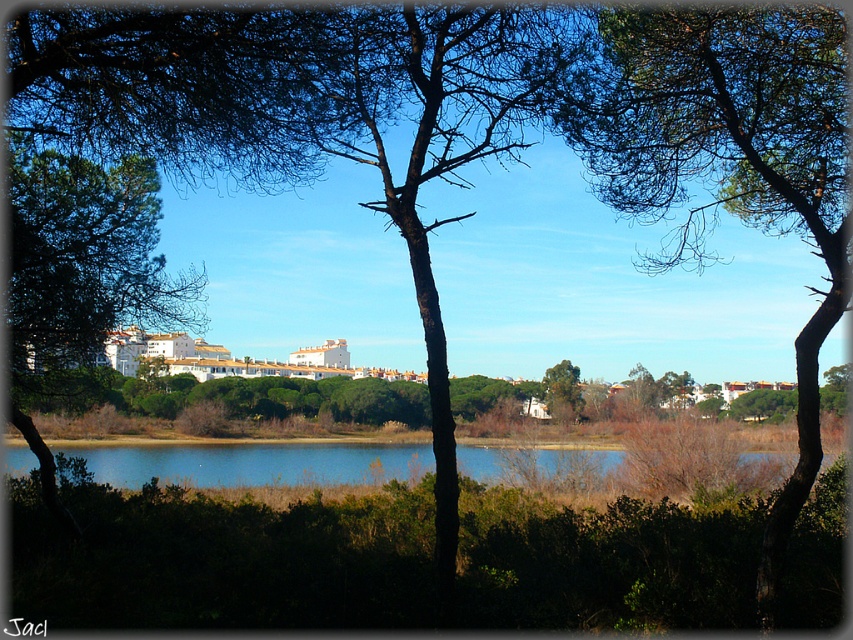
Question: Is blue water at center wider than green matte tree at center?

Choices:
 (A) no
 (B) yes

Answer: (B)

Question: Which of the following is the closest to the observer?

Choices:
 (A) (570, 456)
 (B) (569, 365)

Answer: (A)

Question: Among these objects, which one is nearest to the camera?

Choices:
 (A) brown textured tree at center
 (B) blue water at center

Answer: (A)

Question: Can you confirm if green matte tree at left is positioned below green matte tree at center?

Choices:
 (A) yes
 (B) no

Answer: (B)

Question: Where is blue water at center located in relation to green matte tree at center in the image?

Choices:
 (A) above
 (B) below

Answer: (B)

Question: Which point is closer to the camera taking this photo?

Choices:
 (A) (474, 451)
 (B) (567, 376)
 (C) (648, 124)

Answer: (C)